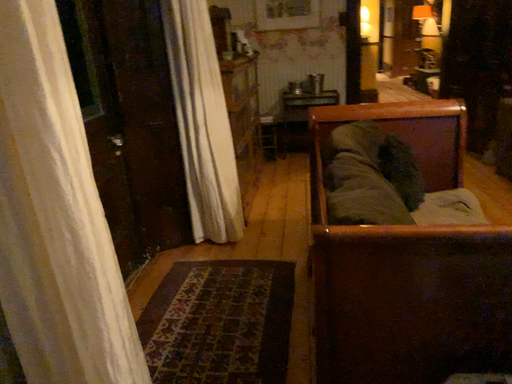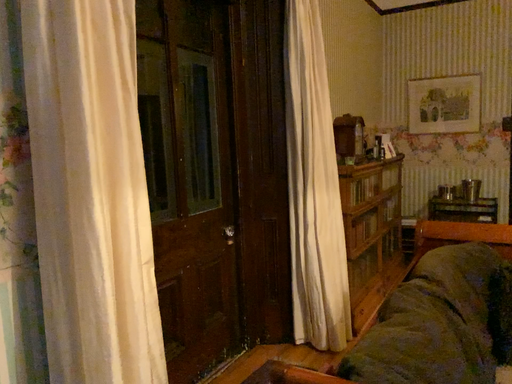
Question: Which way did the camera rotate in the video?

Choices:
 (A) rotated upward
 (B) rotated downward

Answer: (A)